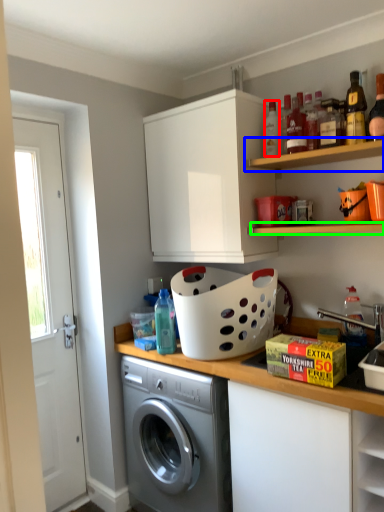
Question: Based on their relative distances, which object is nearer to bottle (highlighted by a red box)? Choose from shelf (highlighted by a blue box) and shelf (highlighted by a green box).

Choices:
 (A) shelf
 (B) shelf

Answer: (A)